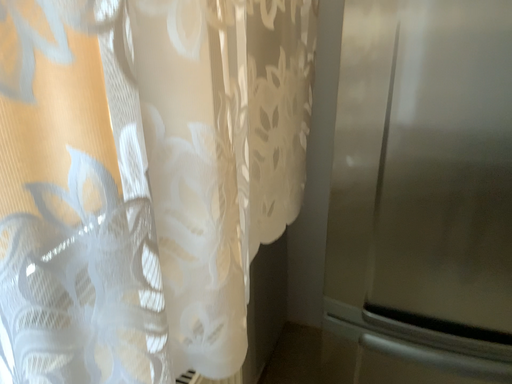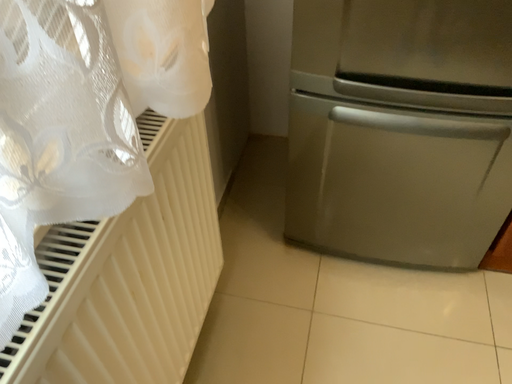
Question: Which way did the camera rotate in the video?

Choices:
 (A) rotated left
 (B) rotated right

Answer: (B)